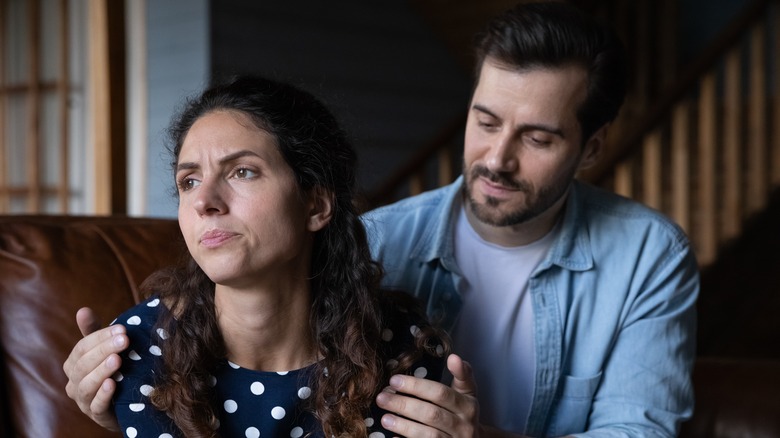
The image size is (780, 438). What are the coordinates of `stairs` in the screenshot? It's located at (700, 158).